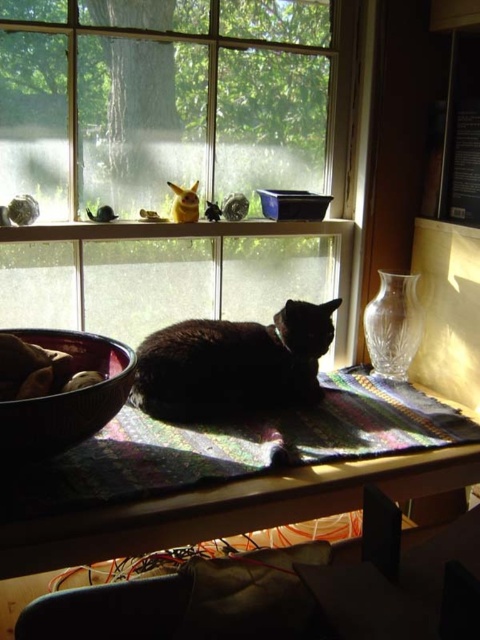
You are a small toy mouse that is 10 centimeters long. You are currently on the multicolored woven mat at center and want to reach the transparent glass window at upper center. Can you crawl directly to the window without moving around any objects?

The transparent glass window at upper center and multicolored woven mat at center are 56.98 centimeters apart from each other. Since you are only 10 centimeters long, you can crawl directly to the window without needing to move around any objects as the distance is manageable for your size.

You are standing in the room and want to place a small plant on the multicolored woven mat at center. Based on the coordinates provided, where exactly should you place the plant?

The multicolored woven mat at center is located at point (x=232, y=448), so you should place the plant at that coordinate to ensure it is centered on the mat.

You are a small robot with a width of 12 inches. You are standing on the wooden surface and want to move from the edge of the wooden surface to the multicolored woven mat at center. Is there enough space for you to move freely without touching the edges?

The distance between you and the multicolored woven mat at center is 37.78 inches. Since your width is 12 inches, the space is sufficient for you to move freely without touching the edges.